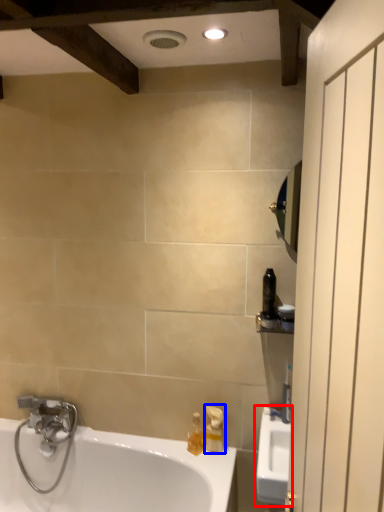
Question: Which object appears farthest to the camera in this image, sink (highlighted by a red box) or soap dispenser (highlighted by a blue box)?

Choices:
 (A) sink
 (B) soap dispenser

Answer: (B)